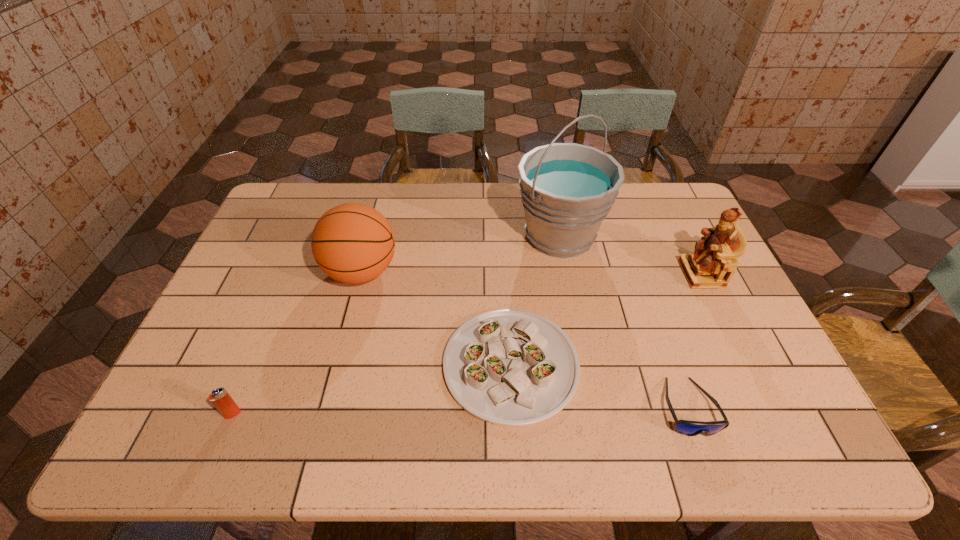
Locate an element on the screen. The height and width of the screenshot is (540, 960). blank space located on the front-facing side of the figurine is located at coordinates (558, 274).

Locate an element on the screen. This screenshot has width=960, height=540. vacant space located 0.250m on the front of the fifth object from right to left is located at coordinates pyautogui.click(x=334, y=376).

In order to click on free space located on the back of the igniter in this screenshot , I will do `click(277, 307)`.

This screenshot has width=960, height=540. I want to click on vacant space located on the left of the platter, so click(305, 364).

The image size is (960, 540). Identify the location of object situated at the far edge. coord(567,189).

Where is `igniter present at the near edge`? igniter present at the near edge is located at coordinates (223, 402).

Find the location of `sunglasses at the near edge`. sunglasses at the near edge is located at coordinates (685, 427).

Locate an element on the screen. platter at the near edge is located at coordinates (508, 367).

Locate an element on the screen. The image size is (960, 540). object that is at the left edge is located at coordinates (223, 402).

This screenshot has width=960, height=540. Identify the location of object that is at the right edge. (713, 263).